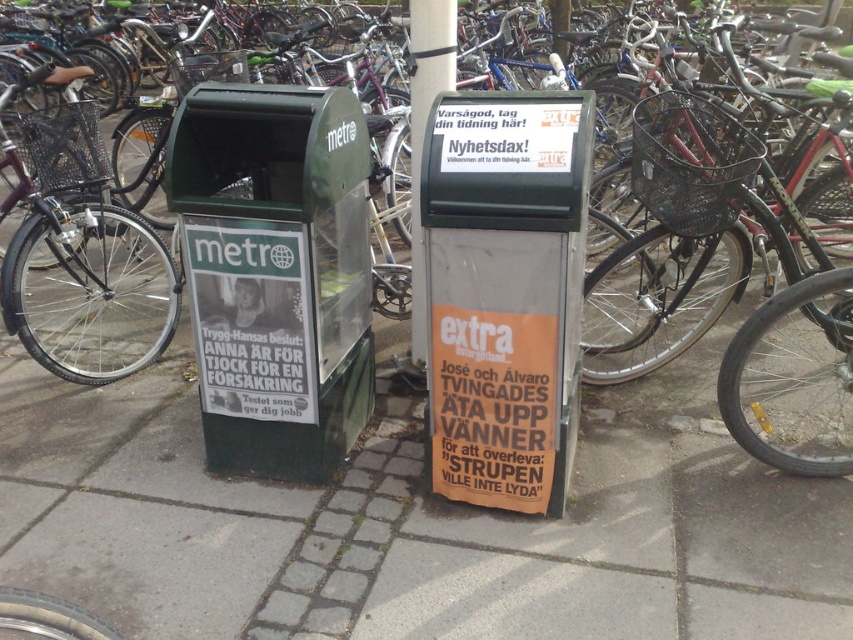
Question: Is black wire basket at right positioned at the back of metallic gray pole at center?

Choices:
 (A) no
 (B) yes

Answer: (A)

Question: Among these points, which one is nearest to the camera?

Choices:
 (A) (749, 266)
 (B) (7, 256)

Answer: (B)

Question: Is black wire basket at right positioned behind shiny black bicycle at left?

Choices:
 (A) no
 (B) yes

Answer: (A)

Question: Which object appears farthest from the camera in this image?

Choices:
 (A) black wire basket at right
 (B) metallic gray pole at center

Answer: (B)

Question: In this image, where is black wire basket at right located relative to shiny black bicycle at left?

Choices:
 (A) below
 (B) above

Answer: (A)

Question: Among these objects, which one is farthest from the camera?

Choices:
 (A) metallic gray pole at center
 (B) shiny black bicycle at left
 (C) black wire basket at right

Answer: (B)